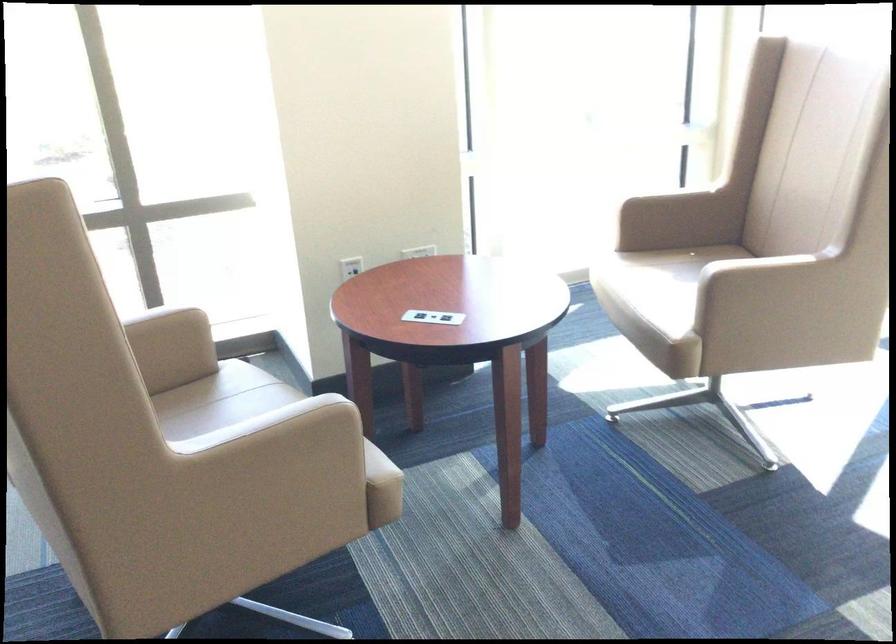
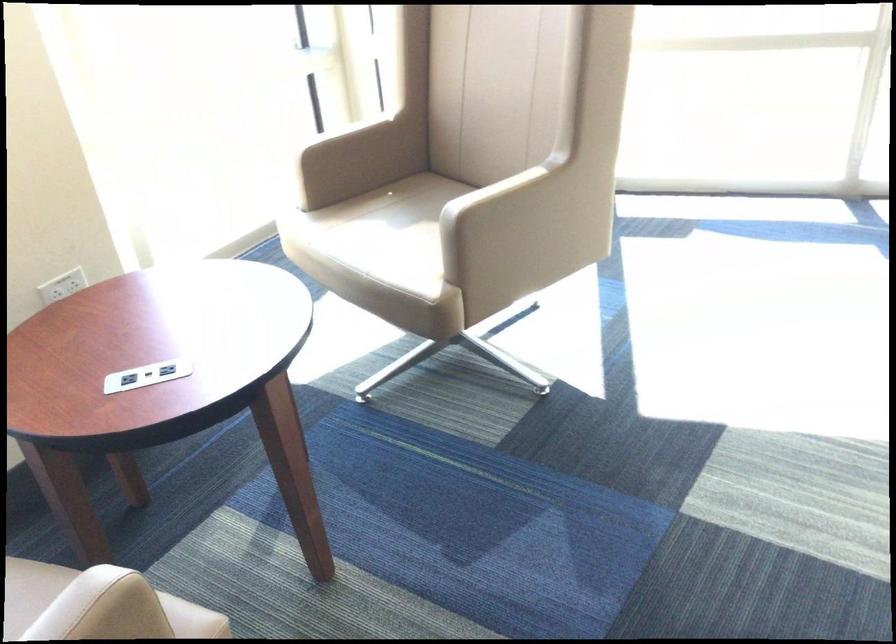
In the second image, find the point that corresponds to [317,411] in the first image.

(97, 605)